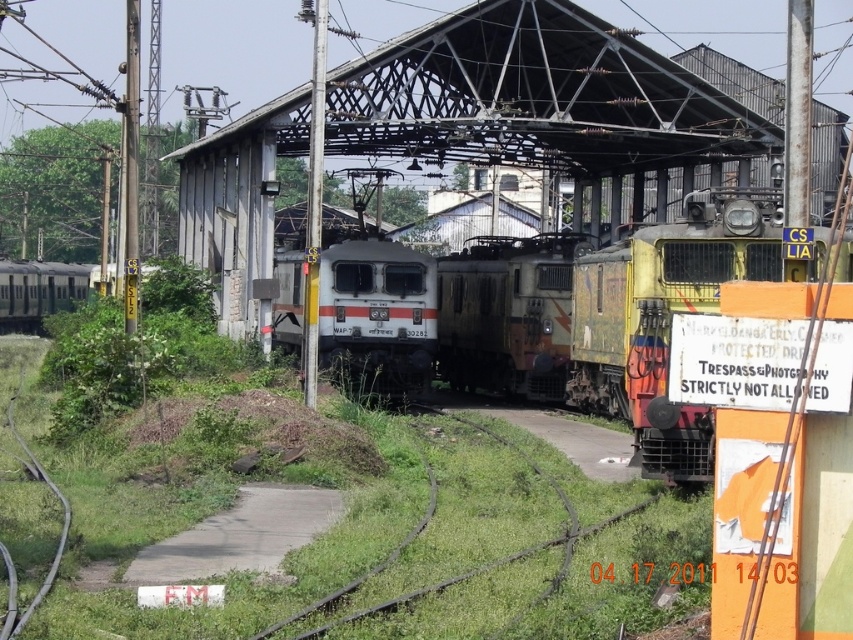
Can you confirm if yellow-green painted locomotive at center is taller than white glossy locomotive at center?

Indeed, yellow-green painted locomotive at center has a greater height compared to white glossy locomotive at center.

Which of these two, yellow-green painted locomotive at center or white glossy locomotive at center, stands shorter?

white glossy locomotive at center

Does point (712, 426) come closer to viewer compared to point (283, 333)?

Yes, point (712, 426) is closer to viewer.

The height and width of the screenshot is (640, 853). Find the location of `yellow-green painted locomotive at center`. yellow-green painted locomotive at center is located at coordinates (x=663, y=317).

Who is taller, yellow-green painted locomotive at center or silver metallic train at left?

With more height is yellow-green painted locomotive at center.

Which is more to the right, yellow-green painted locomotive at center or silver metallic train at left?

yellow-green painted locomotive at center

Does point (695, 428) come in front of point (36, 264)?

Yes, point (695, 428) is closer to viewer.

This screenshot has width=853, height=640. What are the coordinates of `yellow-green painted locomotive at center` in the screenshot? It's located at (663, 317).

Is rusty metal train at center below white glossy locomotive at center?

No.

Can you confirm if rusty metal train at center is positioned above white glossy locomotive at center?

Indeed, rusty metal train at center is positioned over white glossy locomotive at center.

Is point (502, 317) behind point (322, 360)?

Yes, it is.

I want to click on rusty metal train at center, so click(508, 314).